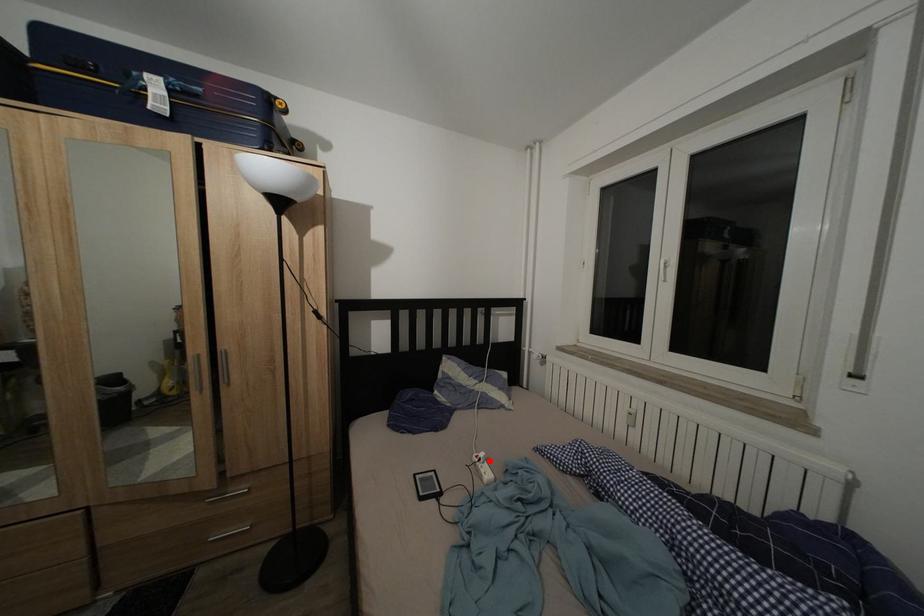
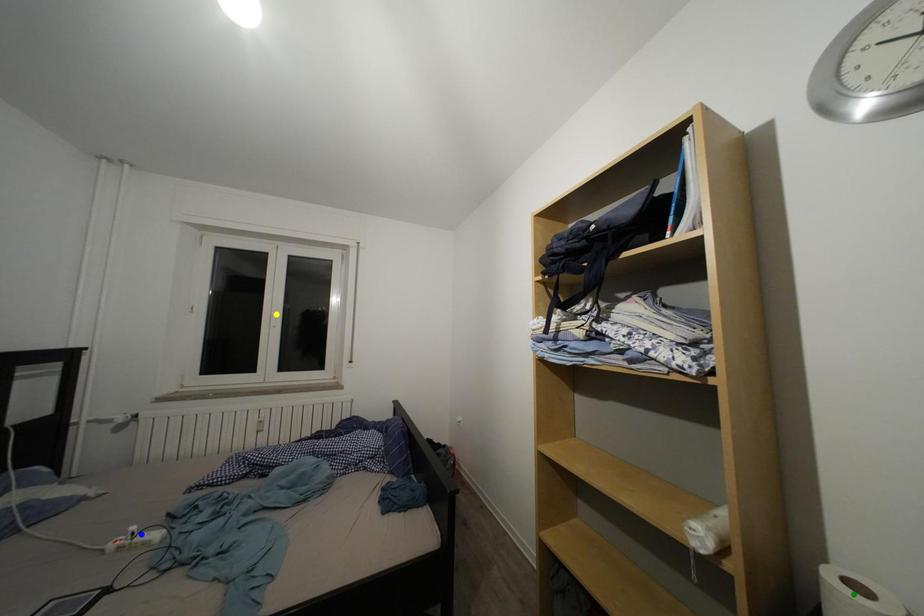
Question: I am providing you with two images of the same scene from different viewpoints. A red point is marked on the first image. You are given multiple points on the second image. In image 2, which mark is for the same physical point as the one in image 1?

Choices:
 (A) blue point
 (B) green point
 (C) yellow point

Answer: (A)